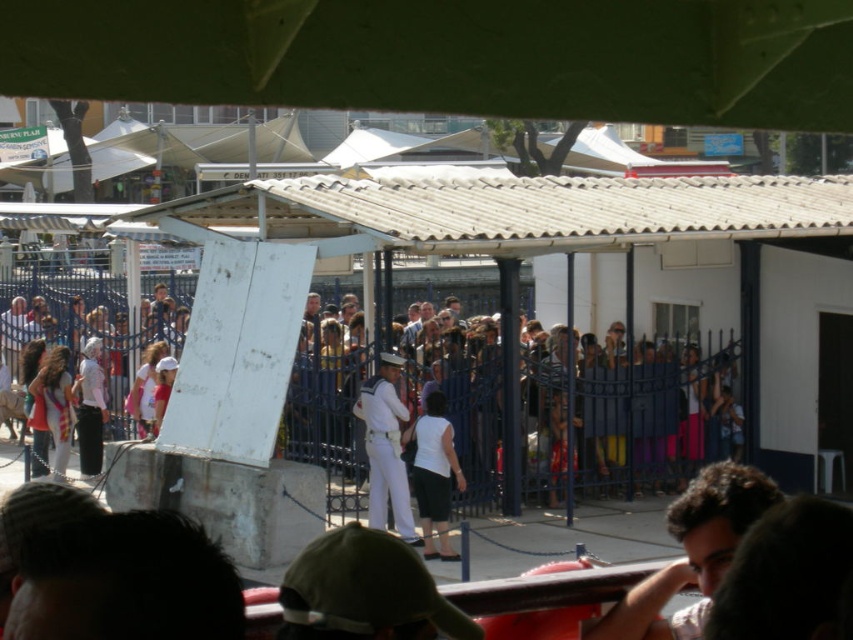
Question: Is brown hair at lower right closer to the viewer compared to white matte skirt at center?

Choices:
 (A) no
 (B) yes

Answer: (B)

Question: Can you confirm if white matte crowd at center is smaller than brown hair at lower right?

Choices:
 (A) no
 (B) yes

Answer: (A)

Question: Observing the image, what is the correct spatial positioning of white matte crowd at center in reference to white matte skirt at center?

Choices:
 (A) below
 (B) above

Answer: (B)

Question: Which of the following is the farthest from the observer?

Choices:
 (A) white matte skirt at center
 (B) white cotton shirt at left
 (C) white matte crowd at center
 (D) brown hair at lower right

Answer: (B)

Question: Which point appears farthest from the camera in this image?

Choices:
 (A) (36, 406)
 (B) (701, 625)
 (C) (421, 509)
 (D) (585, 362)

Answer: (A)

Question: Which object is the closest to the brown hair at lower right?

Choices:
 (A) white matte crowd at center
 (B) white cotton shirt at left
 (C) white matte skirt at center

Answer: (C)